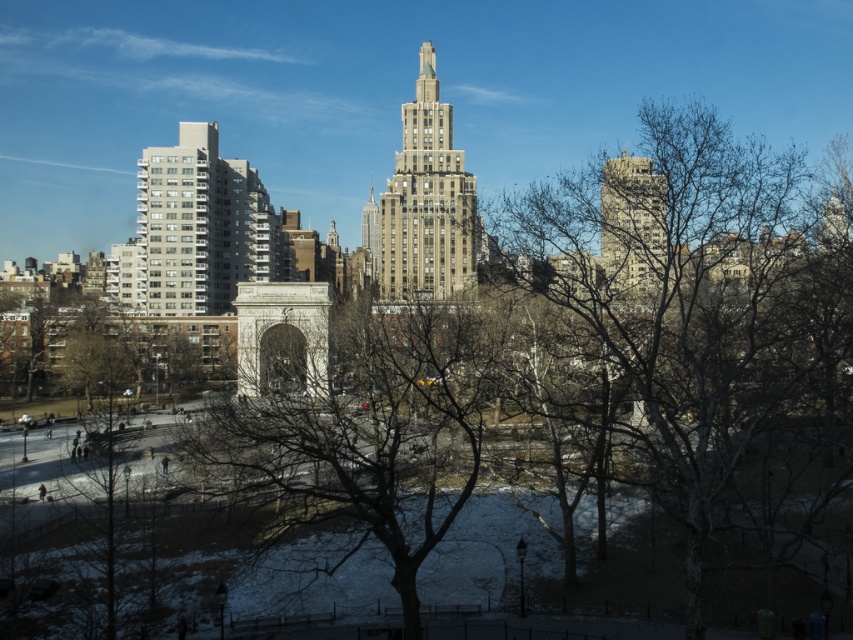
You are a city planner analyzing the park layout. You need to determine which structure, the smooth concrete building at upper right or the smooth beige skyscraper at center, occupies more horizontal space in the image. Based on the available information, which one is wider?

The smooth concrete building at upper right might be wider than smooth beige skyscraper at center.

You are a photographer planning to capture the brown textured building at center and smooth beige skyscraper at center in a single shot. Based on their heights, which one should you position closer to the center of your camera frame to emphasize its dominance?

The brown textured building at center is taller than the smooth beige skyscraper at center, so positioning it closer to the center of your camera frame will emphasize its dominance due to its greater height.